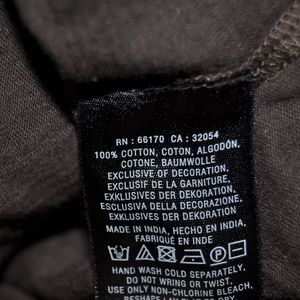
You are a GUI agent. You are given a task and a screenshot of the screen. Output one action in this format:
    pyautogui.click(x=<x>, y=<y>)
    Task: Click on the iron
    The width and height of the screenshot is (300, 300).
    Given the screenshot: What is the action you would take?
    point(199,261)